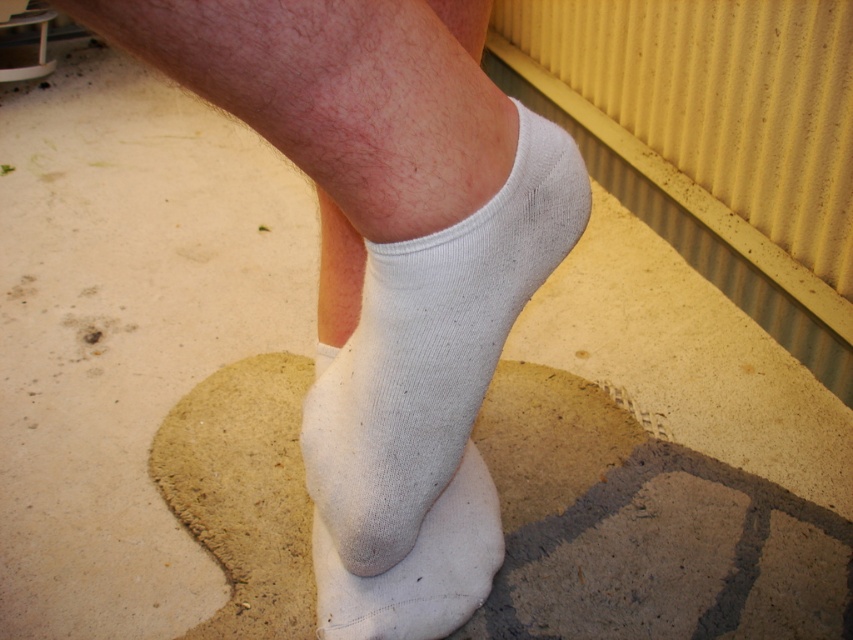
Question: Which point is closer to the camera taking this photo?

Choices:
 (A) (424, 483)
 (B) (508, 179)
 (C) (425, 566)

Answer: (B)

Question: Is white cotton socks at center bigger than white cotton sock at lower center?

Choices:
 (A) yes
 (B) no

Answer: (A)

Question: Does white cotton socks at center have a greater width compared to white cotton sock at lower center?

Choices:
 (A) no
 (B) yes

Answer: (B)

Question: Which point is closer to the camera taking this photo?

Choices:
 (A) (329, 204)
 (B) (389, 387)
 (C) (479, 540)

Answer: (B)

Question: Does white cotton socks at center lie behind white cotton sock at lower center?

Choices:
 (A) no
 (B) yes

Answer: (A)

Question: Among these points, which one is farthest from the camera?

Choices:
 (A) (485, 490)
 (B) (469, 593)

Answer: (A)